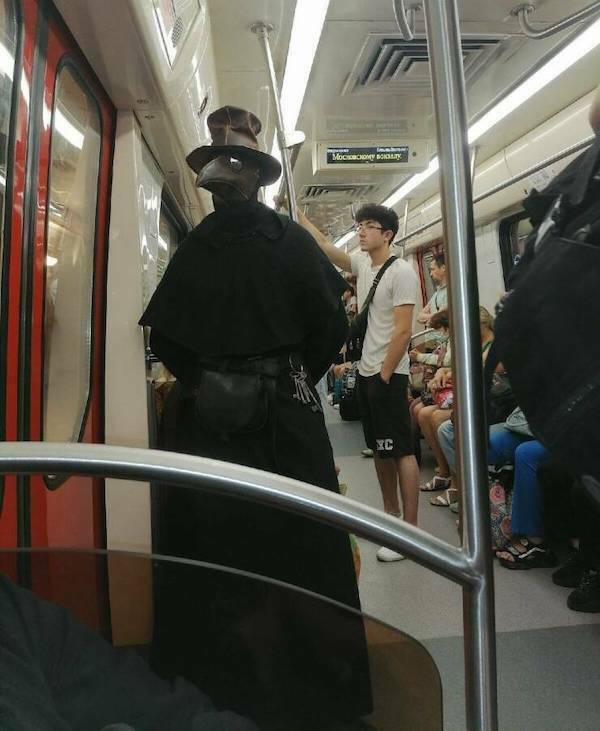
Find the location of a particular element. This screenshot has height=731, width=600. gray floor surface is located at coordinates (429, 596).